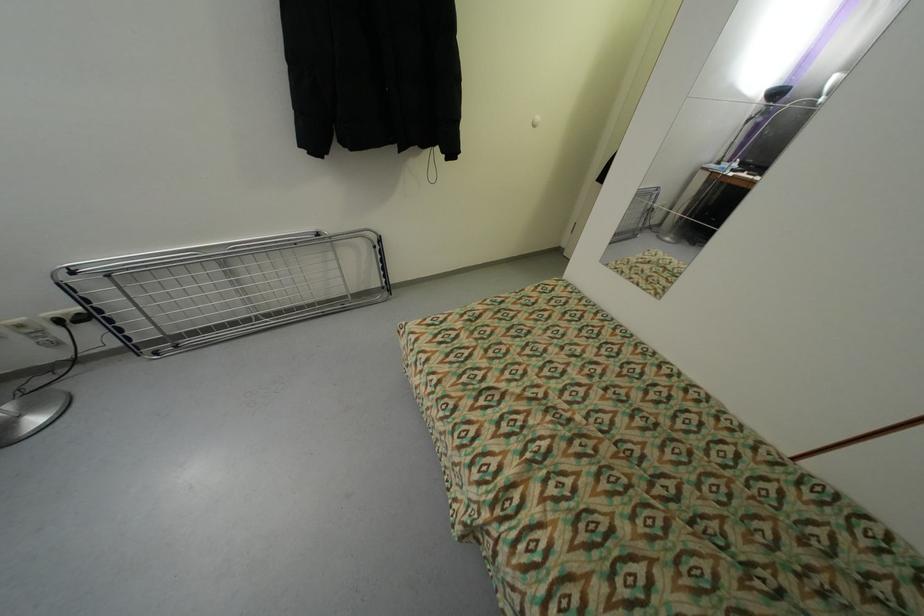
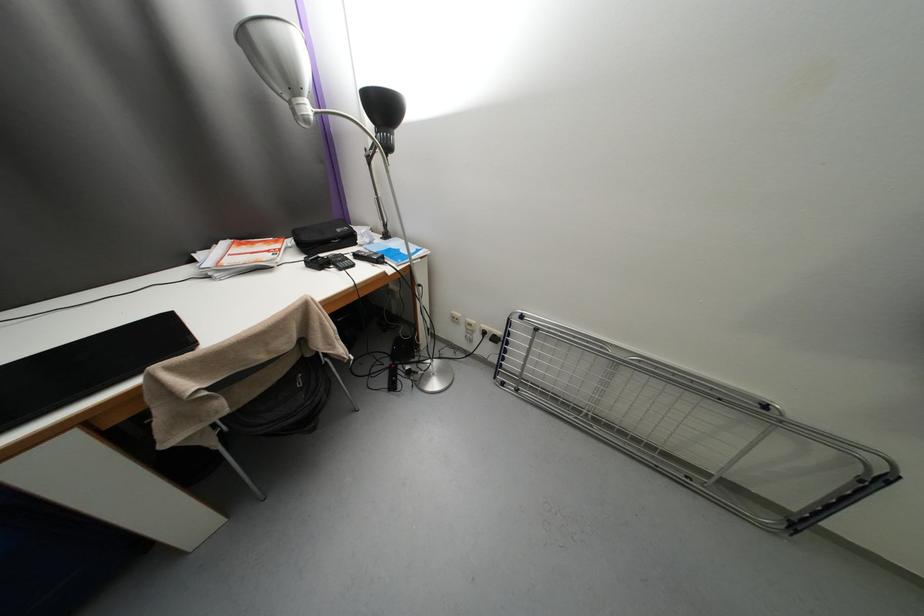
Question: How did the camera likely rotate?

Choices:
 (A) Left
 (B) Right
 (C) Up
 (D) Down

Answer: (A)